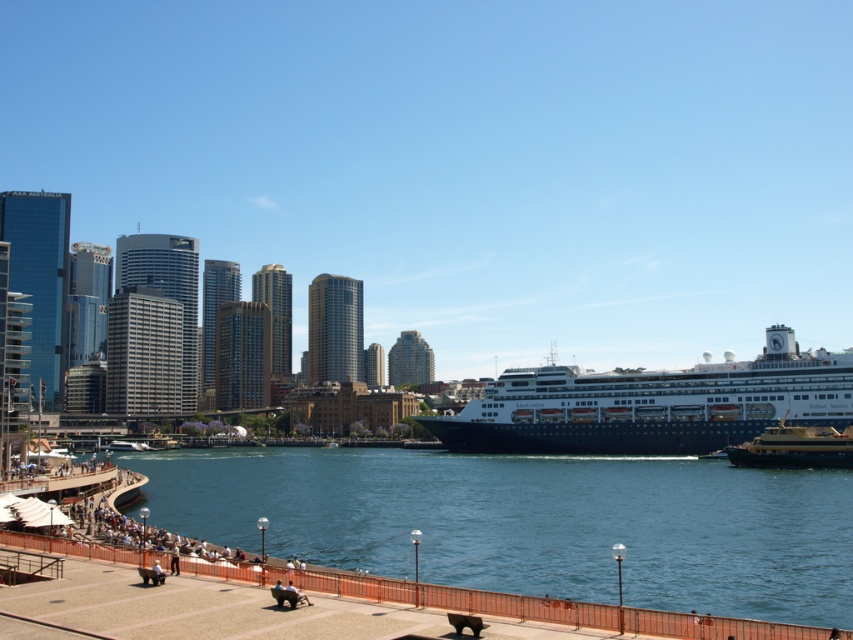
Question: Can you confirm if blue water at lower center is thinner than blue glossy cruise ship at center?

Choices:
 (A) yes
 (B) no

Answer: (B)

Question: Observing the image, what is the correct spatial positioning of blue glossy cruise ship at center in reference to gold polished metal ferry at center?

Choices:
 (A) left
 (B) right

Answer: (A)

Question: Which object is positioned closest to the gold polished metal ferry at center?

Choices:
 (A) blue water at lower center
 (B) blue glossy cruise ship at center

Answer: (B)

Question: Estimate the real-world distances between objects in this image. Which object is closer to the blue glossy cruise ship at center?

Choices:
 (A) gold polished metal ferry at center
 (B) blue water at lower center

Answer: (A)

Question: Which of the following is the farthest from the observer?

Choices:
 (A) blue water at lower center
 (B) blue glossy cruise ship at center

Answer: (B)

Question: Does blue glossy cruise ship at center appear on the right side of gold polished metal ferry at center?

Choices:
 (A) yes
 (B) no

Answer: (B)